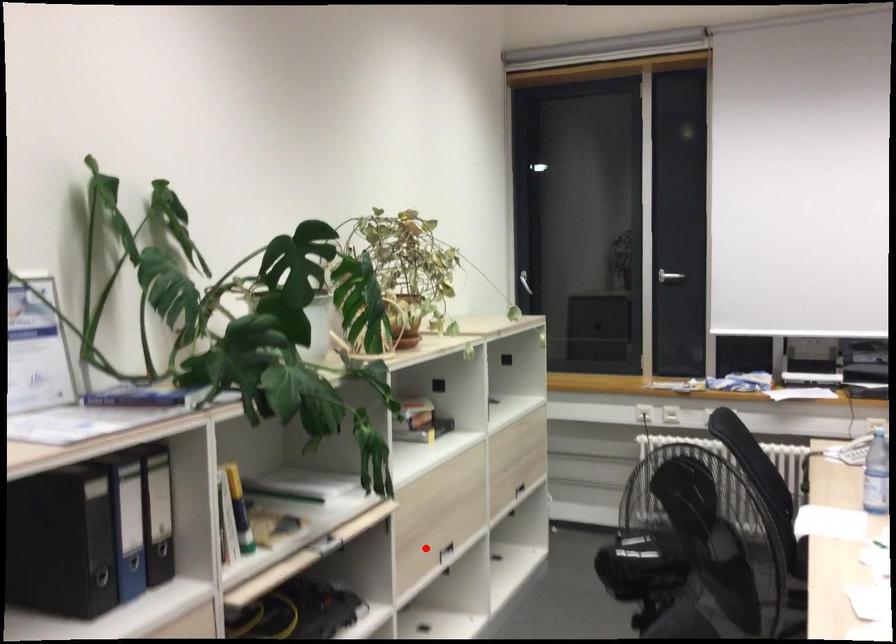
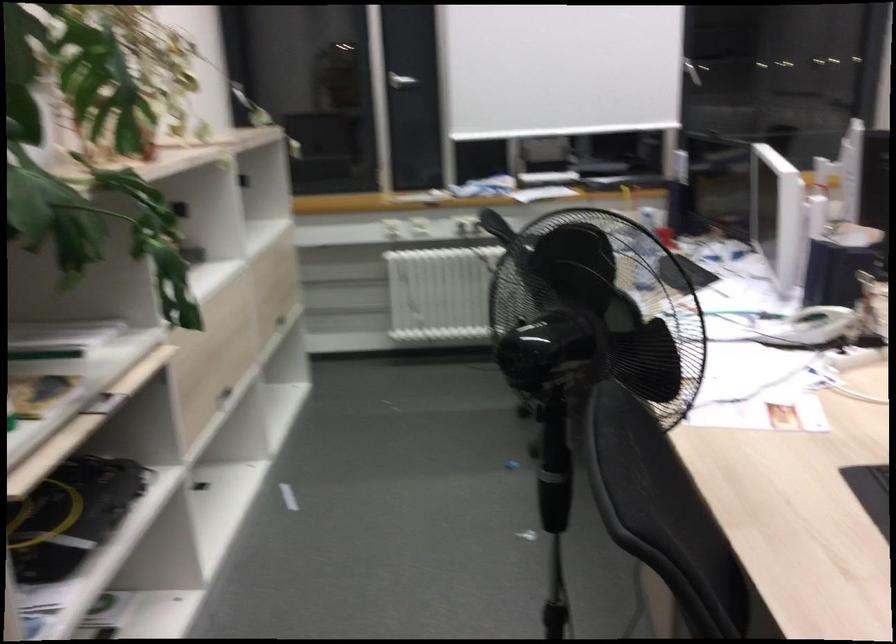
Question: I am providing you with two images of the same scene from different viewpoints. Given a red point in image1, look at the same physical point in image2. Is it:

Choices:
 (A) Closer to the viewpoint
 (B) Farther from the viewpoint

Answer: (A)